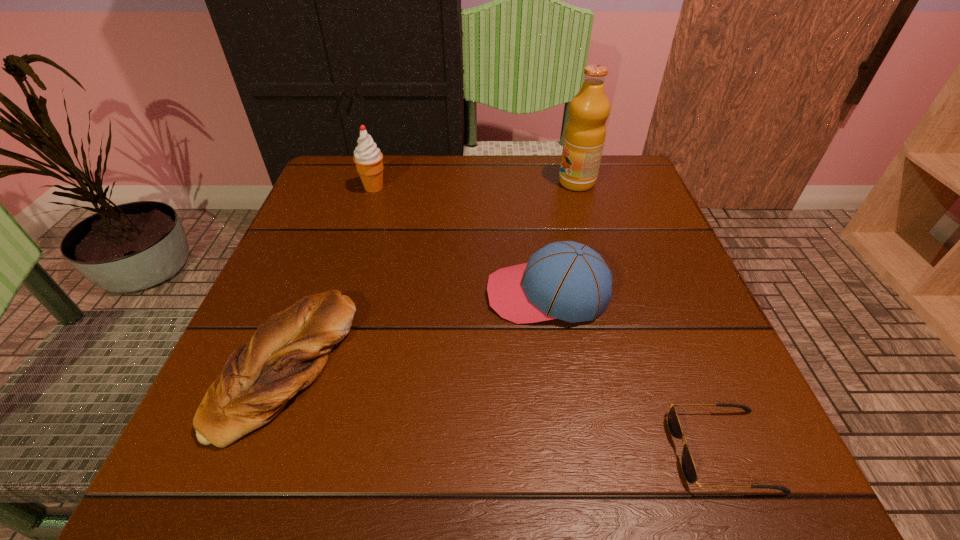
At what (x,y) coordinates should I click in order to perform the action: click on vacant position located 0.060m on the front-facing side of the baseball cap. Please return your answer as a coordinate pair (x, y). The height and width of the screenshot is (540, 960). Looking at the image, I should click on (454, 294).

At what (x,y) coordinates should I click in order to perform the action: click on free space located 0.220m on the front-facing side of the baseball cap. Please return your answer as a coordinate pair (x, y). Looking at the image, I should click on (367, 294).

Where is `free space located on the back of the fourth tallest object`? Image resolution: width=960 pixels, height=540 pixels. free space located on the back of the fourth tallest object is located at coordinates (342, 219).

The image size is (960, 540). In order to click on blank area located on the front-facing side of the shortest object in this screenshot , I will do `click(557, 450)`.

Locate an element on the screen. vacant area located on the front-facing side of the shortest object is located at coordinates (609, 450).

Find the location of a particular element. The height and width of the screenshot is (540, 960). vacant space situated 0.280m on the front-facing side of the shortest object is located at coordinates (468, 450).

Image resolution: width=960 pixels, height=540 pixels. Identify the location of fruit juice that is at the far edge. (585, 132).

At what (x,y) coordinates should I click in order to perform the action: click on icecream located in the far edge section of the desktop. Please return your answer as a coordinate pair (x, y). Image resolution: width=960 pixels, height=540 pixels. Looking at the image, I should click on (368, 159).

The width and height of the screenshot is (960, 540). What are the coordinates of `bread at the near edge` in the screenshot? It's located at (289, 349).

What are the coordinates of `sunglasses that is at the near edge` in the screenshot? It's located at (688, 467).